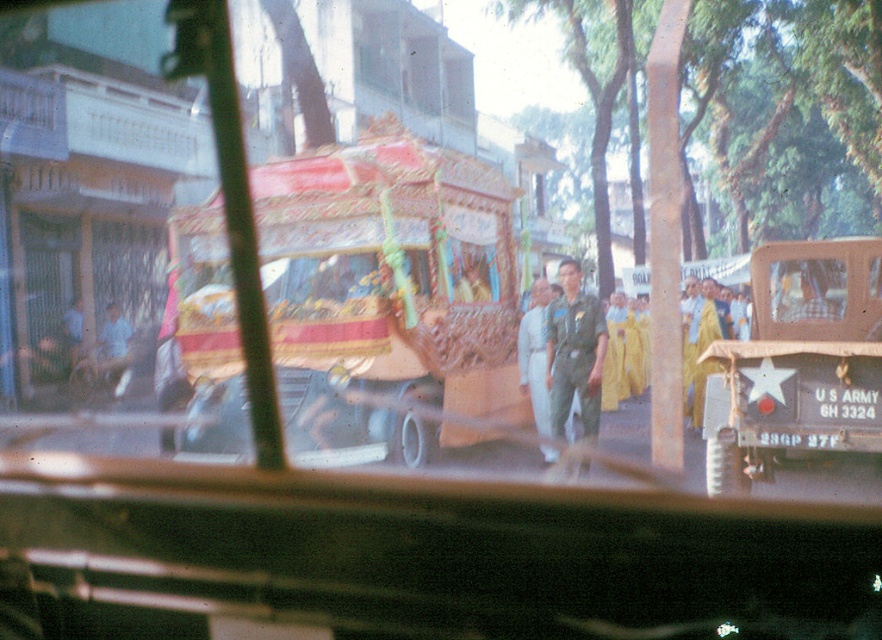
Question: Which object is closer to the camera taking this photo?

Choices:
 (A) green uniform at center
 (B) light blue uniform at center
 (C) camouflage fabric food truck at right

Answer: (C)

Question: Can you confirm if decorative wood cart at center is positioned above light blue uniform at center?

Choices:
 (A) yes
 (B) no

Answer: (A)

Question: Which object is the farthest from the green uniform at center?

Choices:
 (A) camouflage fabric food truck at right
 (B) light blue uniform at center

Answer: (A)

Question: Is decorative wood cart at center below light blue uniform at center?

Choices:
 (A) yes
 (B) no

Answer: (B)

Question: Is decorative wood cart at center behind camouflage fabric food truck at right?

Choices:
 (A) yes
 (B) no

Answer: (A)

Question: Estimate the real-world distances between objects in this image. Which object is closer to the green uniform at center?

Choices:
 (A) decorative wood cart at center
 (B) camouflage fabric food truck at right
 (C) light blue uniform at center

Answer: (C)